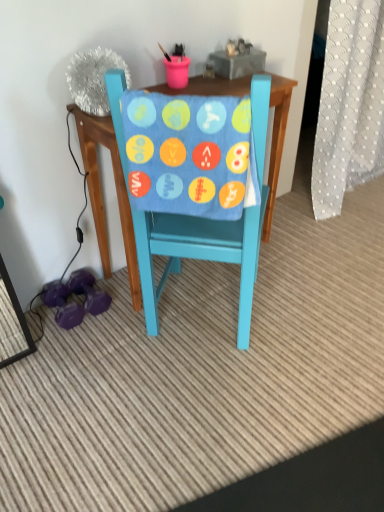
Question: Is teal painted wood chair at center not inside blue soft fabric at center?

Choices:
 (A) no
 (B) yes

Answer: (B)

Question: Considering the relative sizes of teal painted wood chair at center and blue soft fabric at center in the image provided, is teal painted wood chair at center taller than blue soft fabric at center?

Choices:
 (A) no
 (B) yes

Answer: (B)

Question: Is the position of teal painted wood chair at center more distant than that of blue soft fabric at center?

Choices:
 (A) no
 (B) yes

Answer: (B)

Question: Is teal painted wood chair at center directly adjacent to blue soft fabric at center?

Choices:
 (A) yes
 (B) no

Answer: (B)

Question: From the image's perspective, is teal painted wood chair at center below blue soft fabric at center?

Choices:
 (A) no
 (B) yes

Answer: (B)

Question: Is teal painted wood chair at center positioned with its back to blue soft fabric at center?

Choices:
 (A) no
 (B) yes

Answer: (B)

Question: Can you confirm if white dotted fabric at right is smaller than blue soft fabric at center?

Choices:
 (A) yes
 (B) no

Answer: (B)

Question: Considering the relative positions of white dotted fabric at right and blue soft fabric at center in the image provided, is white dotted fabric at right to the left of blue soft fabric at center from the viewer's perspective?

Choices:
 (A) no
 (B) yes

Answer: (A)

Question: From a real-world perspective, is white dotted fabric at right on top of blue soft fabric at center?

Choices:
 (A) no
 (B) yes

Answer: (A)

Question: From a real-world perspective, is white dotted fabric at right beneath blue soft fabric at center?

Choices:
 (A) no
 (B) yes

Answer: (B)

Question: From the image's perspective, does white dotted fabric at right appear lower than blue soft fabric at center?

Choices:
 (A) yes
 (B) no

Answer: (B)

Question: Could you tell me if white dotted fabric at right is facing blue soft fabric at center?

Choices:
 (A) no
 (B) yes

Answer: (A)

Question: Is teal painted wood chair at center surrounded by white dotted fabric at right?

Choices:
 (A) yes
 (B) no

Answer: (B)